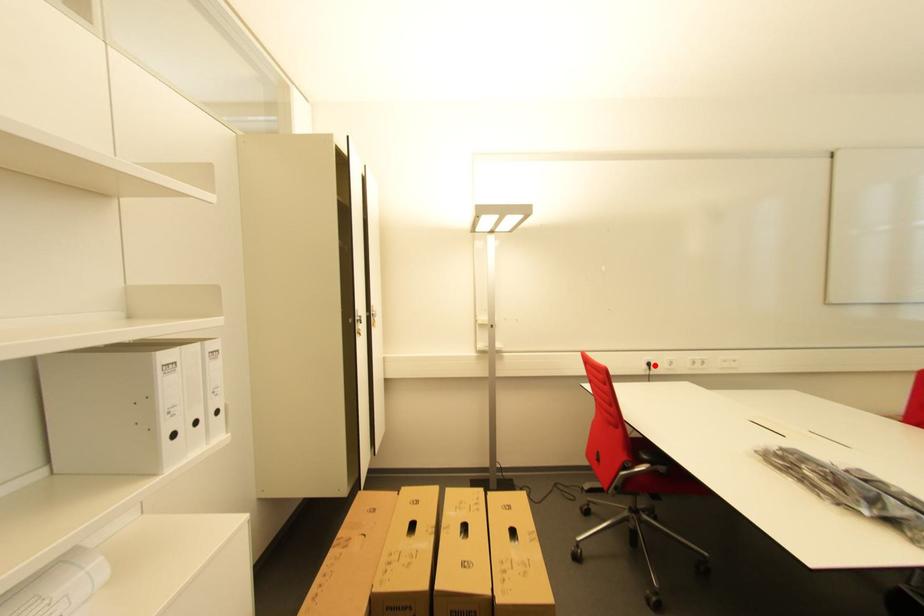
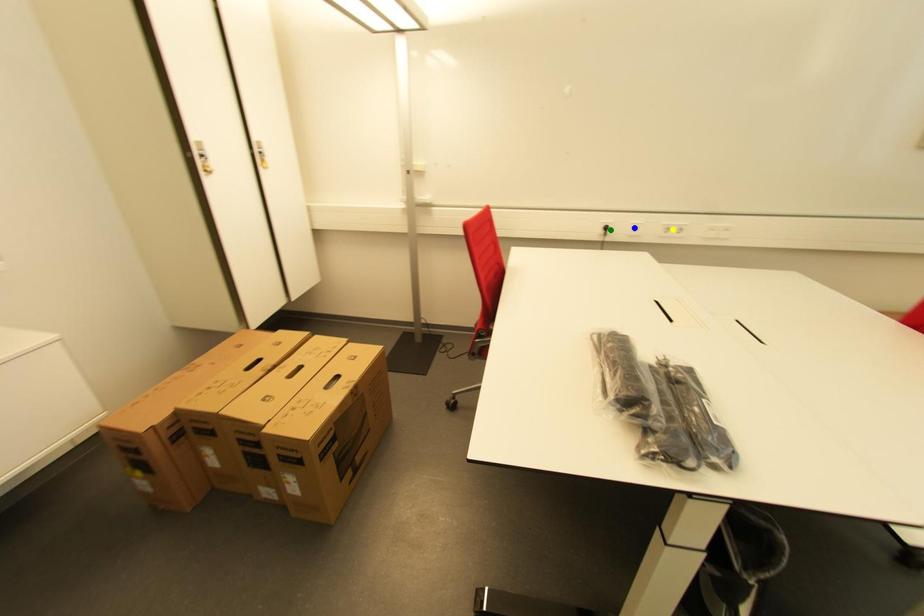
Question: I am providing you with two images of the same scene from different viewpoints. A red point is marked on the first image. You are given multiple points on the second image. In image 2, which mark is for the same physical point as the one in image 1?

Choices:
 (A) yellow point
 (B) blue point
 (C) green point

Answer: (C)